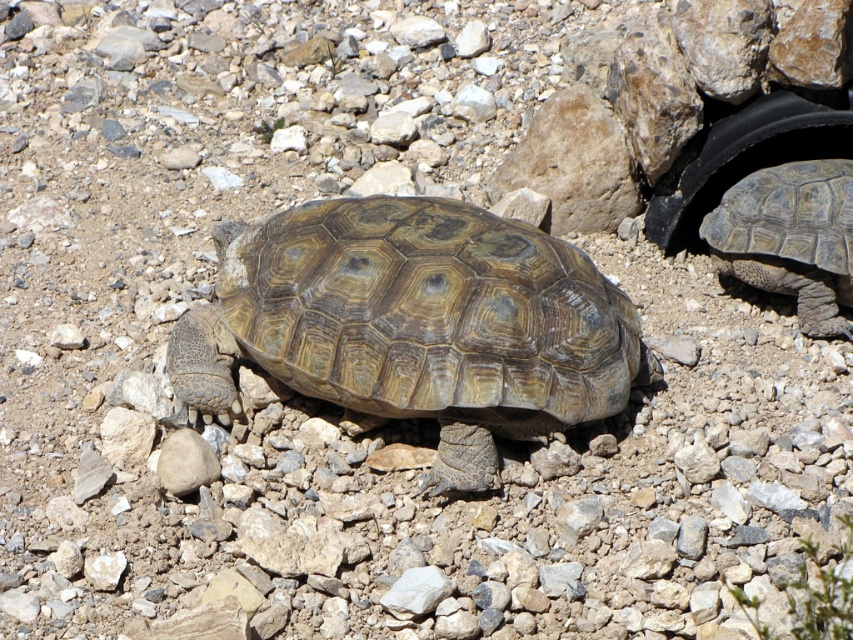
You are a desert explorer who needs to identify the position of the brown textured shell at center relative to the leathery brown tortoise at right. Based on the scene description, which object is closer to you?

The brown textured shell at center is closer to you because it is in front of the leathery brown tortoise at right.

You are a desert explorer who has spotted a desert tortoise in the middle of a rocky desert. You notice a specific point at coordinates [416,324]. Can you determine if this point is located on the tortoise or the surrounding rocks?

The point at [416,324] is on the brown textured shell at center, so it is located on the tortoise.